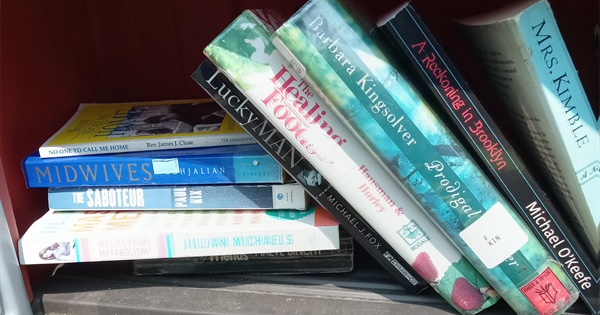
Find the location of a particular element. The image size is (600, 315). book is located at coordinates (555, 87), (460, 106), (390, 119), (321, 133), (276, 143), (223, 133), (225, 166), (240, 201), (235, 232), (246, 260).